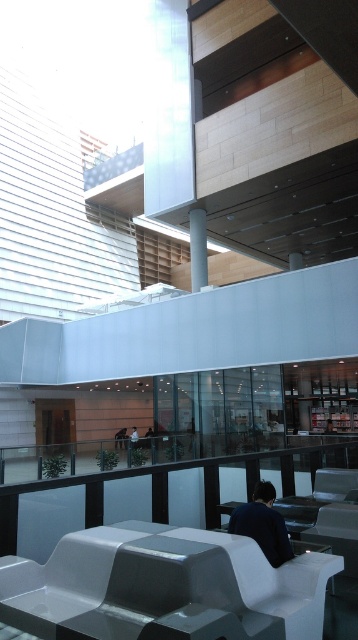
Does point (249, 509) come closer to viewer compared to point (133, 448)?

That is True.

Where is `dark blue shirt at center`? Image resolution: width=358 pixels, height=640 pixels. dark blue shirt at center is located at coordinates (263, 524).

Does white glossy bench at lower center have a greater width compared to white glossy pillar at upper center?

Yes, white glossy bench at lower center is wider than white glossy pillar at upper center.

Can you confirm if white glossy bench at lower center is thinner than white glossy pillar at upper center?

In fact, white glossy bench at lower center might be wider than white glossy pillar at upper center.

Image resolution: width=358 pixels, height=640 pixels. Describe the element at coordinates (162, 582) in the screenshot. I see `white glossy bench at lower center` at that location.

The height and width of the screenshot is (640, 358). In order to click on white glossy bench at lower center in this screenshot , I will do pyautogui.click(x=162, y=582).

Who is positioned more to the left, white glossy bench at lower center or dark blue shirt at center?

white glossy bench at lower center

What do you see at coordinates (162, 582) in the screenshot? I see `white glossy bench at lower center` at bounding box center [162, 582].

You are a GUI agent. You are given a task and a screenshot of the screen. Output one action in this format:
    pyautogui.click(x=<x>, y=<y>)
    Task: Click on the white glossy bench at lower center
    This screenshot has width=358, height=640.
    Given the screenshot: What is the action you would take?
    (x=162, y=582)